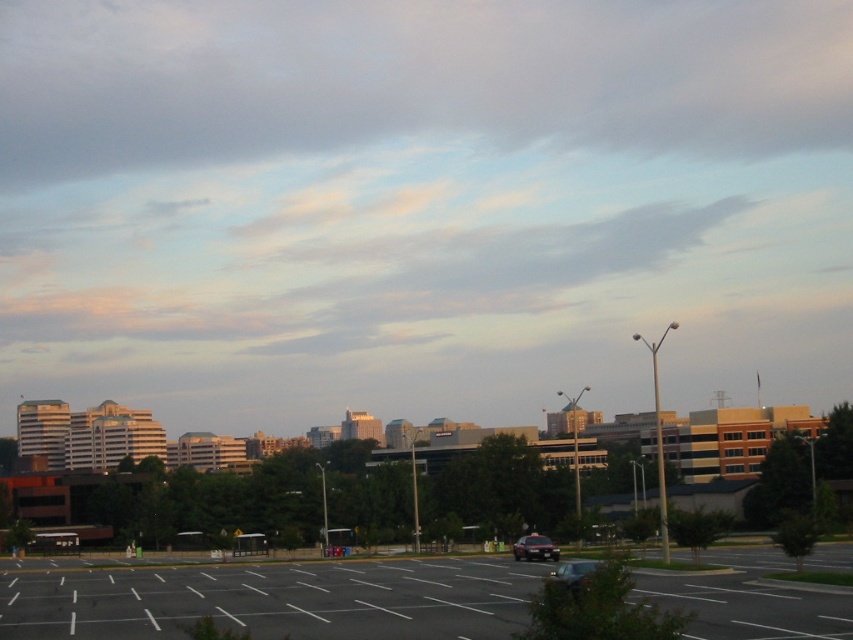
Question: Among these objects, which one is nearest to the camera?

Choices:
 (A) metallic silver sedan at lower center
 (B) black asphalt parking lot at center

Answer: (B)

Question: Which point appears farthest from the camera in this image?

Choices:
 (A) (532, 548)
 (B) (567, 580)
 (C) (206, 60)

Answer: (C)

Question: Which object appears farthest from the camera in this image?

Choices:
 (A) pastel cotton clouds at upper center
 (B) metallic silver sedan at center
 (C) black asphalt parking lot at center
 (D) gray/cloudy sky at upper center

Answer: (D)

Question: Is pastel cotton clouds at upper center closer to the viewer compared to metallic silver sedan at lower center?

Choices:
 (A) yes
 (B) no

Answer: (B)

Question: Can you confirm if gray/cloudy sky at upper center is positioned above metallic silver sedan at center?

Choices:
 (A) yes
 (B) no

Answer: (A)

Question: Considering the relative positions of pastel cotton clouds at upper center and metallic silver sedan at center in the image provided, where is pastel cotton clouds at upper center located with respect to metallic silver sedan at center?

Choices:
 (A) below
 (B) above

Answer: (B)